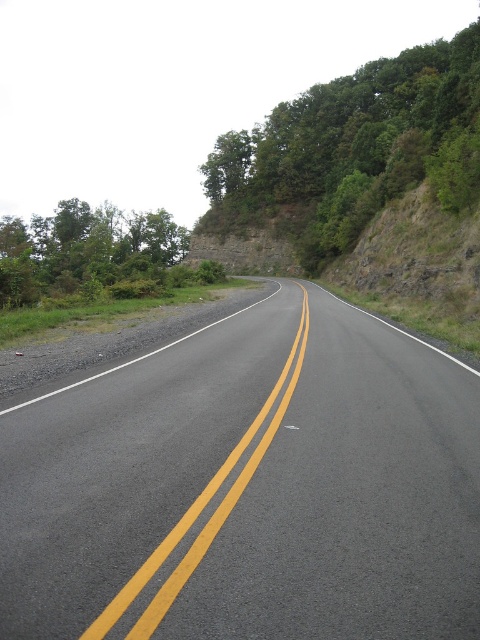
You are standing on the side of the road and want to cross the asphalt road at center. The road is 3 meters wide. Can you safely cross it without stepping into the double yellow line?

The asphalt road at center and viewer are 3.52 meters apart. Since the road is 3 meters wide, you can safely cross it without stepping into the double yellow line as the distance between you and the road is sufficient.

You are a drone operator trying to capture an aerial view of the asphalt road at center. To ensure the road is centered in your shot, where should you position the camera? Please provide coordinates based on the image grid system where the bottom left corner is the origin point.

The asphalt road at center is located at point (248, 486) in the image grid system, so you should position the camera at those coordinates to center the road in the shot.

You are driving a car and need to park under a tree for shade. The asphalt road at center is where you are currently driving. Can you park under the green leafy tree at upper center without leaving the road?

The asphalt road at center is positioned under the green leafy tree at upper center, so yes, you can park under the green leafy tree at upper center while staying on the asphalt road at center.